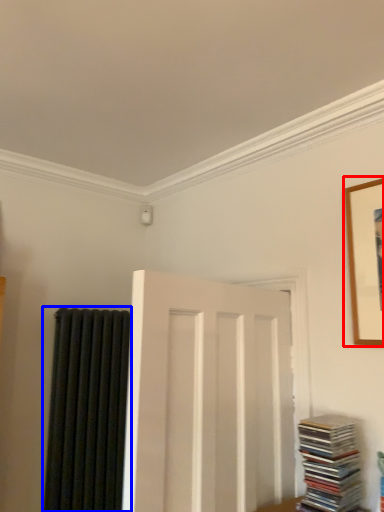
Question: Which point is closer to the camera, picture frame (highlighted by a red box) or curtain (highlighted by a blue box)?

Choices:
 (A) picture frame
 (B) curtain

Answer: (A)